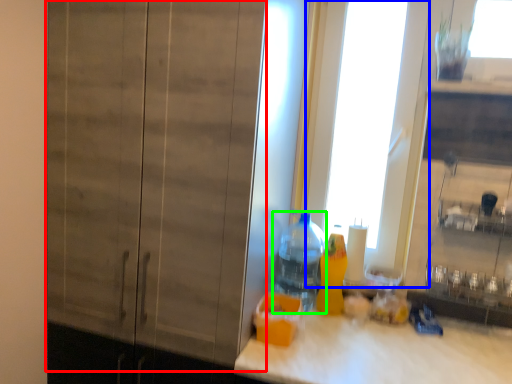
Question: Which object is positioned closest to barn door (highlighted by a red box)? Select from glass door (highlighted by a blue box) and bottle (highlighted by a green box).

Choices:
 (A) glass door
 (B) bottle

Answer: (B)